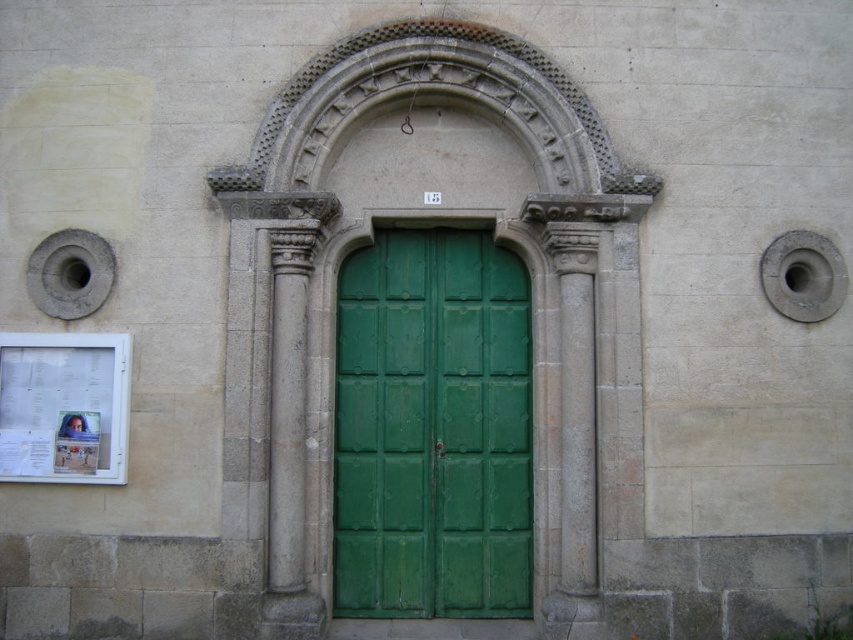
Question: Is green wooden door at center to the right of gray stone column at center from the viewer's perspective?

Choices:
 (A) yes
 (B) no

Answer: (A)

Question: Is green wooden door at center smaller than gray stone column at center?

Choices:
 (A) no
 (B) yes

Answer: (A)

Question: Is green wooden door at center positioned in front of gray stone column at center?

Choices:
 (A) yes
 (B) no

Answer: (B)

Question: Which object appears closest to the camera in this image?

Choices:
 (A) gray stone column at center
 (B) green wooden door at center

Answer: (A)

Question: Which point appears closest to the camera in this image?

Choices:
 (A) (358, 365)
 (B) (273, 444)

Answer: (B)